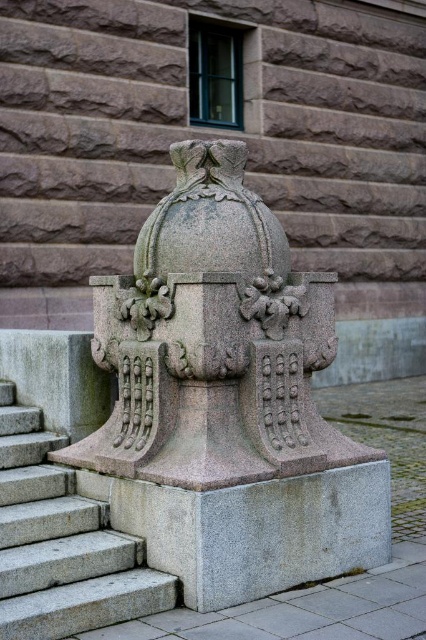
Question: Among these objects, which one is nearest to the camera?

Choices:
 (A) gray granite stairs at lower left
 (B) granite sculpture at center

Answer: (A)

Question: Which point is farther to the camera?

Choices:
 (A) granite sculpture at center
 (B) gray granite stairs at lower left

Answer: (A)

Question: Does granite sculpture at center have a lesser width compared to gray granite stairs at lower left?

Choices:
 (A) yes
 (B) no

Answer: (B)

Question: Can you confirm if granite sculpture at center is wider than gray granite stairs at lower left?

Choices:
 (A) no
 (B) yes

Answer: (B)

Question: Is granite sculpture at center bigger than gray granite stairs at lower left?

Choices:
 (A) no
 (B) yes

Answer: (B)